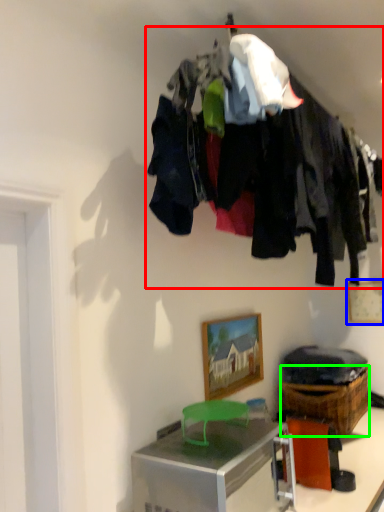
Question: Based on their relative distances, which object is nearer to closet (highlighted by a red box)? Choose from picture frame (highlighted by a blue box) and crate (highlighted by a green box).

Choices:
 (A) picture frame
 (B) crate

Answer: (B)